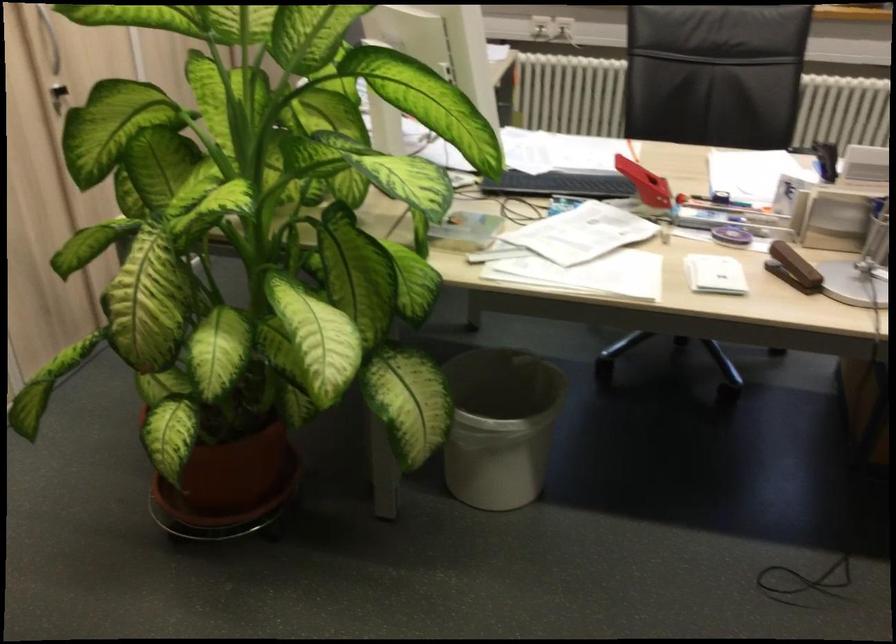
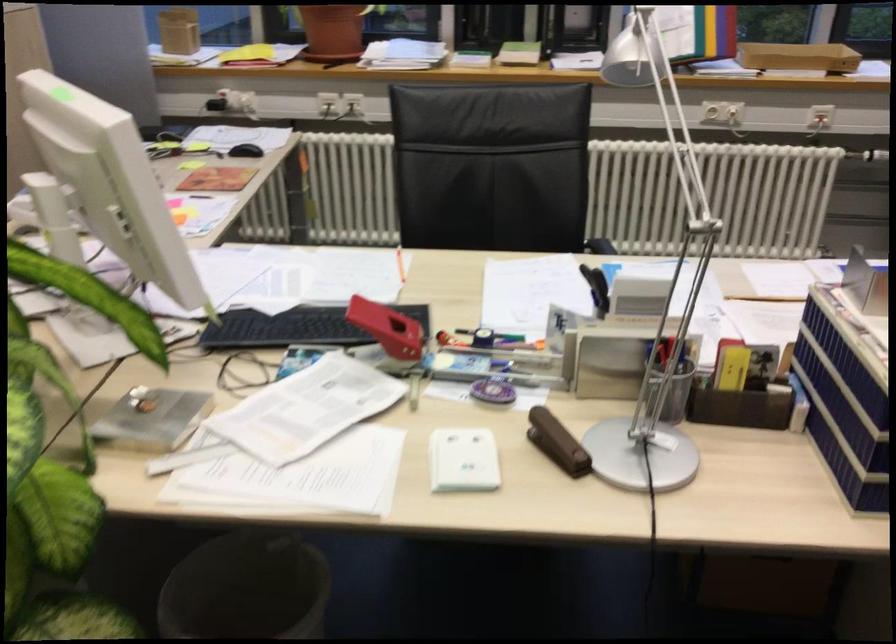
Question: The first image is from the beginning of the video and the second image is from the end. How did the camera likely rotate when shooting the video?

Choices:
 (A) Left
 (B) Right
 (C) Up
 (D) Down

Answer: (B)